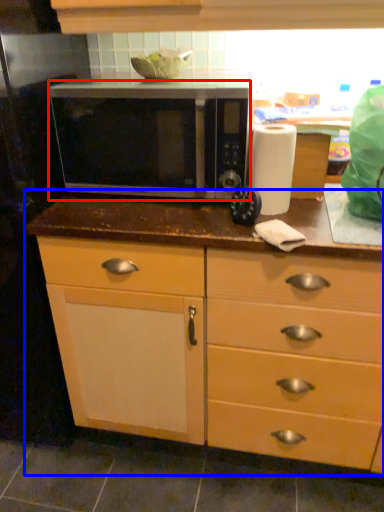
Question: Which point is further to the camera, microwave oven (highlighted by a red box) or cabinetry (highlighted by a blue box)?

Choices:
 (A) microwave oven
 (B) cabinetry

Answer: (A)